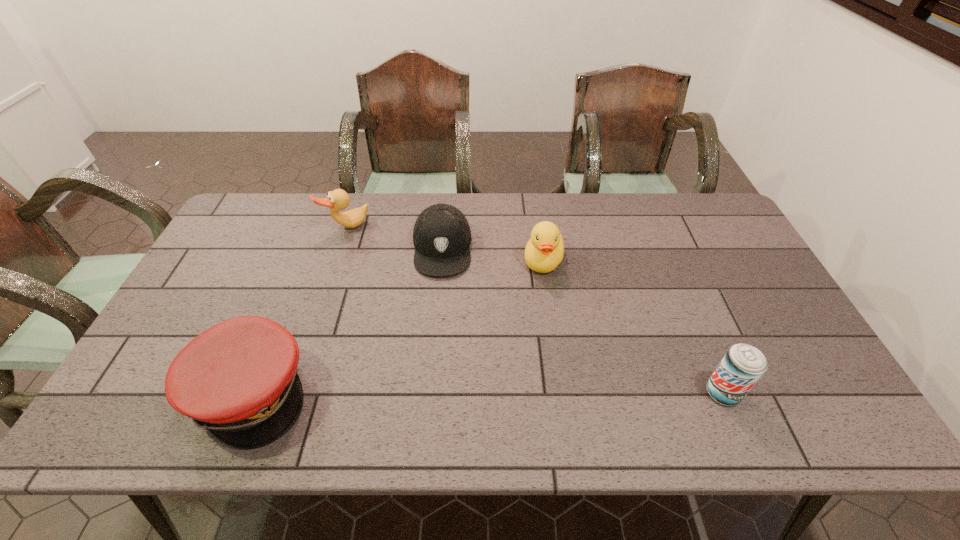
The height and width of the screenshot is (540, 960). Identify the location of free space that is in between the nearer duck and the beer can. (633, 327).

Locate an element on the screen. The image size is (960, 540). vacant area that lies between the right cap and the nearer cap is located at coordinates (347, 320).

You are a GUI agent. You are given a task and a screenshot of the screen. Output one action in this format:
    pyautogui.click(x=<x>, y=<y>)
    Task: Click on the free point between the right cap and the rightmost object
    This screenshot has width=960, height=540.
    Given the screenshot: What is the action you would take?
    pyautogui.click(x=583, y=320)

Where is `free space that is in between the rightmost object and the left cap`? free space that is in between the rightmost object and the left cap is located at coordinates (487, 393).

Find the location of a particular element. The width and height of the screenshot is (960, 540). free area in between the farther duck and the right cap is located at coordinates (395, 238).

The image size is (960, 540). I want to click on vacant space in between the rightmost object and the right cap, so click(583, 320).

This screenshot has width=960, height=540. I want to click on free space between the left cap and the beer can, so click(487, 393).

The image size is (960, 540). What are the coordinates of `unoccupied position between the third object from right to left and the beer can` in the screenshot? It's located at (583, 320).

Where is `empty space between the left duck and the nearer cap`? empty space between the left duck and the nearer cap is located at coordinates (299, 309).

Find the location of a particular element. vacant space in between the left cap and the rightmost object is located at coordinates (487, 393).